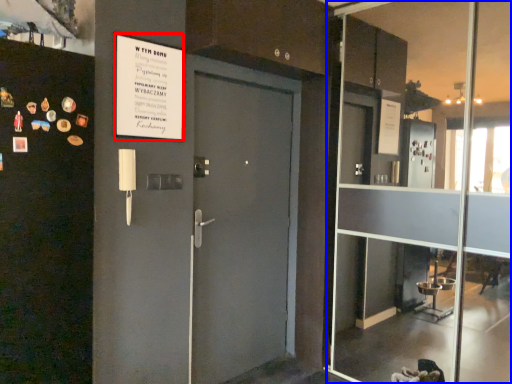
Question: Among these objects, which one is nearest to the camera, poster (highlighted by a red box) or glass door (highlighted by a blue box)?

Choices:
 (A) poster
 (B) glass door

Answer: (B)